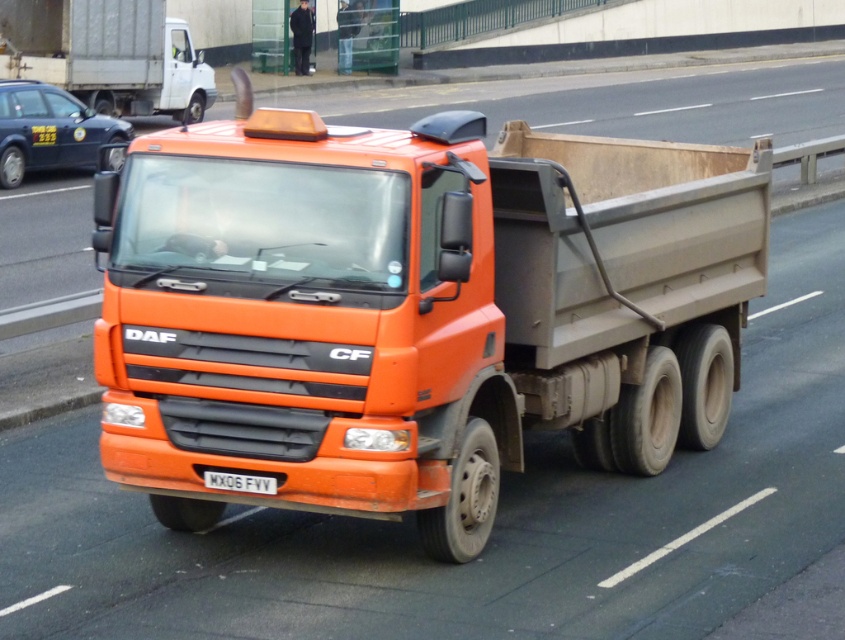
Question: Which point is farther from the camera taking this photo?

Choices:
 (A) (237, 480)
 (B) (117, 134)

Answer: (B)

Question: Observing the image, what is the correct spatial positioning of orange matte truck at center in reference to orange matte truck at upper left?

Choices:
 (A) above
 (B) below

Answer: (B)

Question: Can you confirm if orange matte truck at upper left is positioned to the right of metallic blue taxi at left?

Choices:
 (A) yes
 (B) no

Answer: (B)

Question: Which of the following is the closest to the observer?

Choices:
 (A) (699, 324)
 (B) (246, 488)
 (C) (14, 161)

Answer: (B)

Question: Is metallic blue taxi at left below white metallic license plate at center?

Choices:
 (A) yes
 (B) no

Answer: (B)

Question: Among these objects, which one is farthest from the camera?

Choices:
 (A) orange matte truck at center
 (B) white metallic license plate at center
 (C) metallic blue taxi at left
 (D) orange matte truck at upper left

Answer: (D)